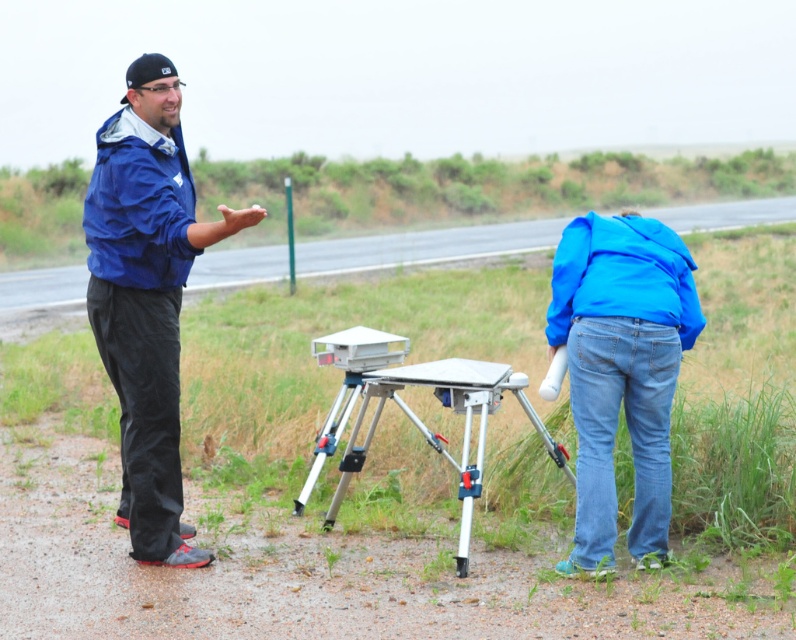
Question: Can you confirm if blue denim jeans at lower right is positioned to the right of silver metallic tripod at center?

Choices:
 (A) yes
 (B) no

Answer: (A)

Question: Is blue denim jeans at lower right to the left of silver metallic tripod at center from the viewer's perspective?

Choices:
 (A) yes
 (B) no

Answer: (B)

Question: Among these points, which one is farthest from the camera?

Choices:
 (A) (172, 177)
 (B) (568, 276)
 (C) (408, 365)

Answer: (C)

Question: Estimate the real-world distances between objects in this image. Which object is farther from the blue matte jacket at left?

Choices:
 (A) silver metallic tripod at center
 (B) blue denim jeans at lower right

Answer: (B)

Question: Where is blue matte jacket at left located in relation to blue denim jeans at lower right in the image?

Choices:
 (A) left
 (B) right

Answer: (A)

Question: Which point is closer to the camera?

Choices:
 (A) (252, 218)
 (B) (303, 488)

Answer: (A)